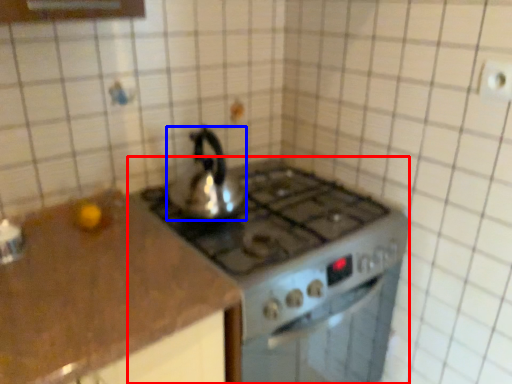
Question: Which object appears closest to the camera in this image, gas stove (highlighted by a red box) or kettle (highlighted by a blue box)?

Choices:
 (A) gas stove
 (B) kettle

Answer: (A)